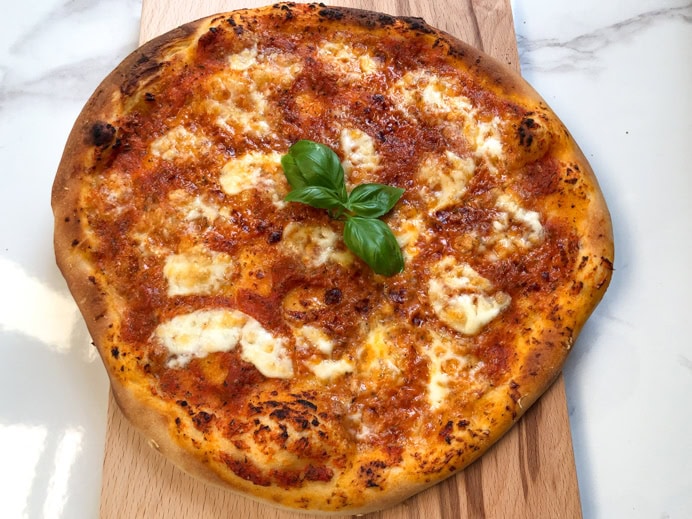
Where is `dark grain in wood`? This screenshot has height=519, width=692. dark grain in wood is located at coordinates tap(475, 491), tap(448, 498), tap(415, 505), tap(520, 456), tap(533, 447), tap(475, 31), tap(401, 9), tap(364, 4).